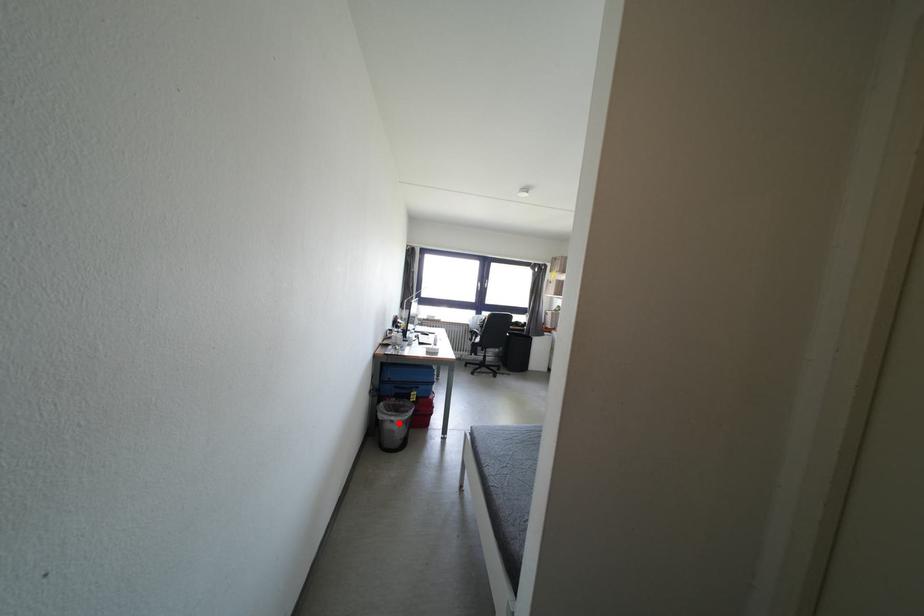
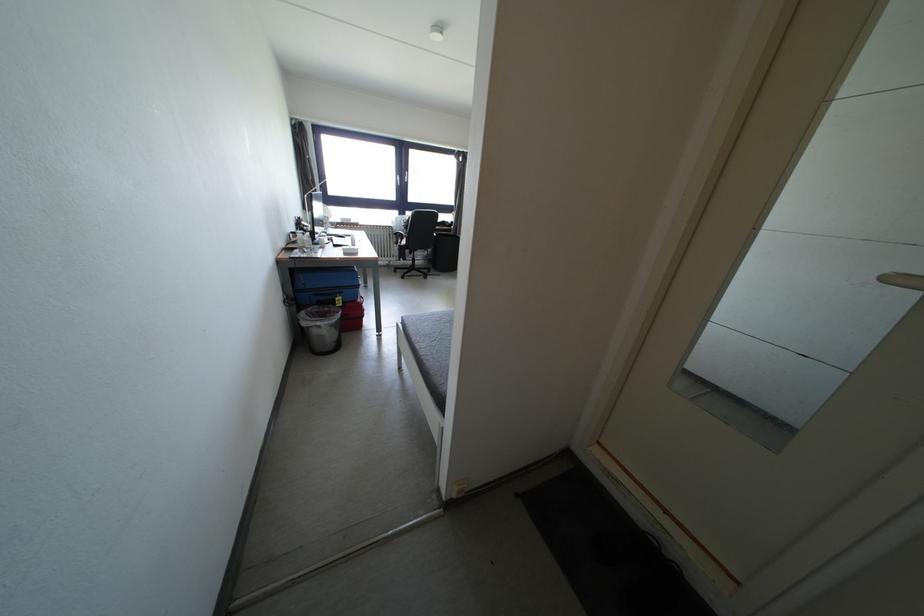
Find the pixel in the second image that matches the highlighted location in the first image.

(324, 328)